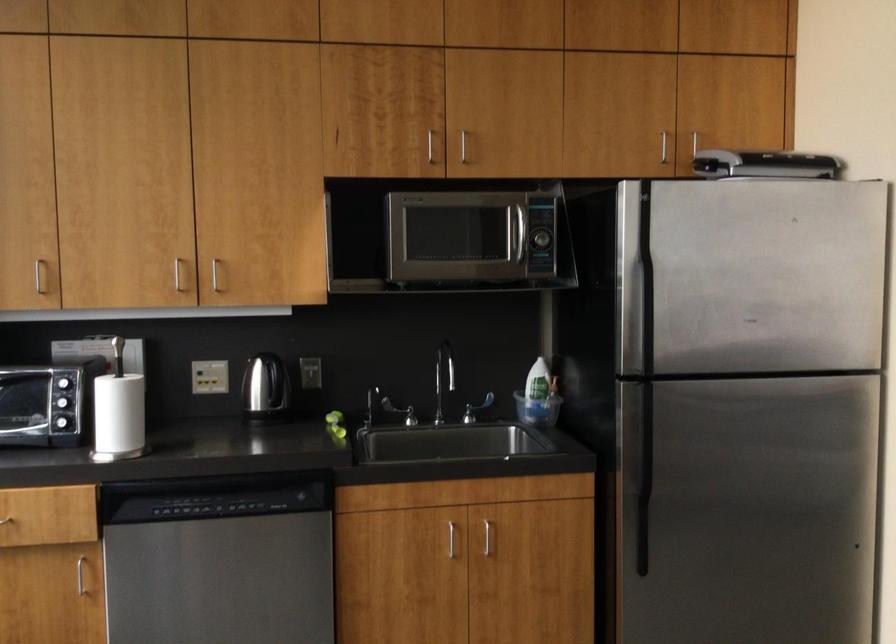
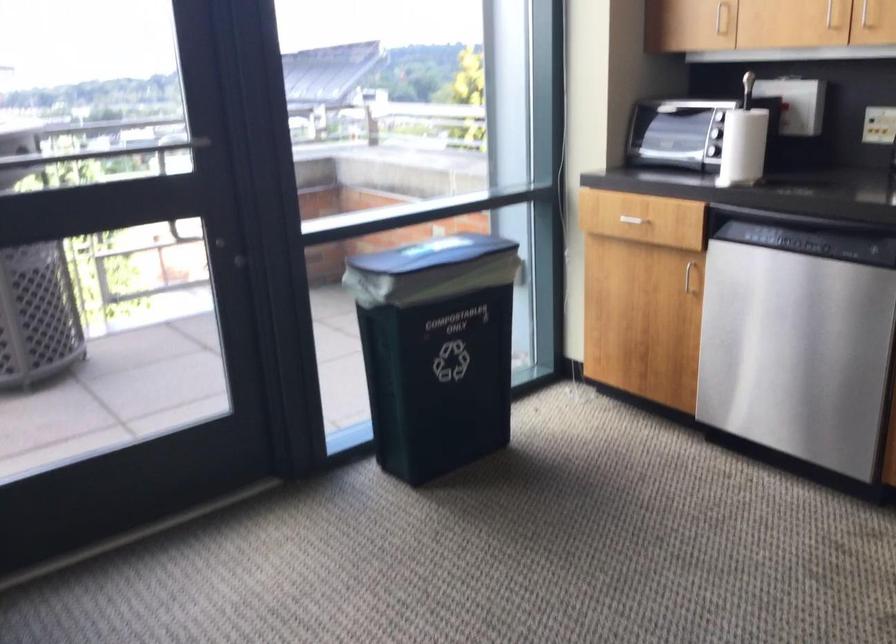
The point at (85, 574) is marked in the first image. Where is the corresponding point in the second image?

(690, 276)